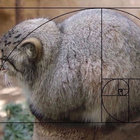
At what (x,y) coordinates should I click in order to perform the action: click on wall. Please return your answer as a coordinate pair (x, y). Image resolution: width=140 pixels, height=140 pixels. Looking at the image, I should click on pyautogui.click(x=26, y=12).